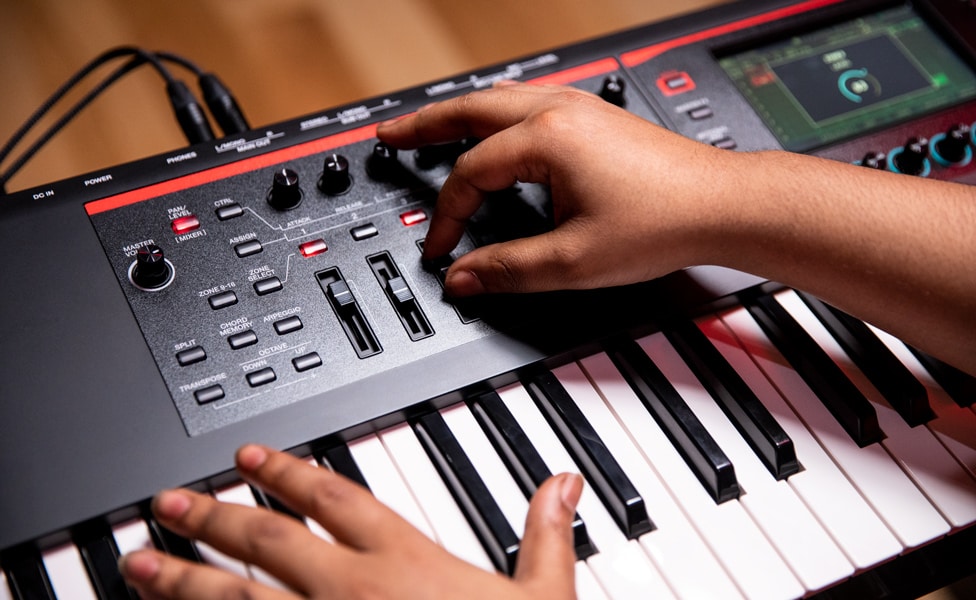
At what (x,y) coordinates should I click in order to perform the action: click on electronic keyboard knob adjusters. Please return your answer as a coordinate pair (x, y). The height and width of the screenshot is (600, 976). Looking at the image, I should click on (290, 180), (342, 168), (386, 162), (432, 155), (873, 158), (914, 147), (956, 137), (974, 133), (615, 86), (148, 261).